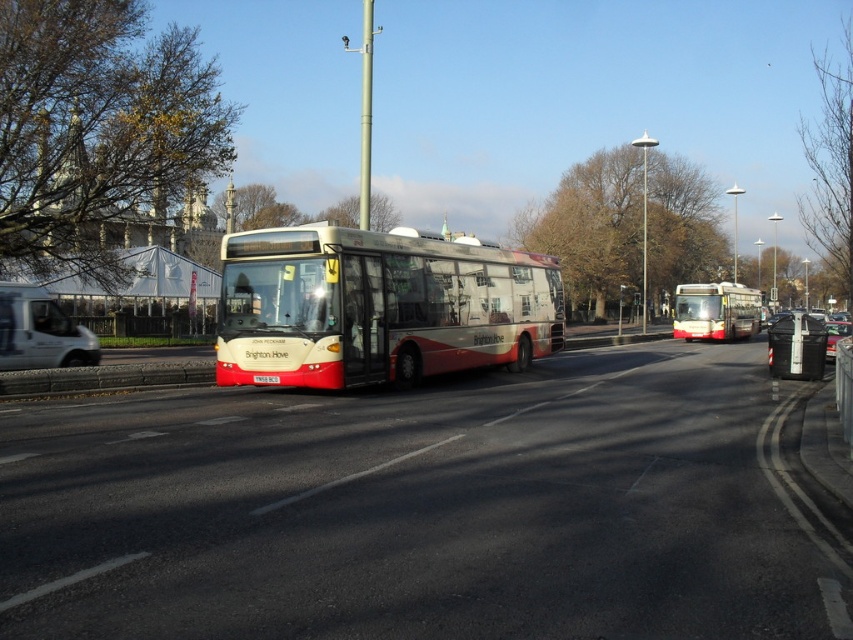
Question: Does red matte bus at center lie in front of black plastic trash can at lower right?

Choices:
 (A) no
 (B) yes

Answer: (A)

Question: Estimate the real-world distances between objects in this image. Which object is closer to the white matte van at left?

Choices:
 (A) black plastic trash can at lower right
 (B) metallic silver car at center

Answer: (A)

Question: Does white glossy bus at center lie in front of white plastic license plate at center?

Choices:
 (A) no
 (B) yes

Answer: (B)

Question: Is white glossy bus at center above white matte van at left?

Choices:
 (A) no
 (B) yes

Answer: (B)

Question: Which of the following is the farthest from the observer?

Choices:
 (A) black plastic trash can at lower right
 (B) metallic silver car at center

Answer: (A)

Question: Which point is closer to the camera taking this photo?

Choices:
 (A) (828, 356)
 (B) (788, 340)
 (C) (477, 356)
 (D) (9, 348)

Answer: (D)